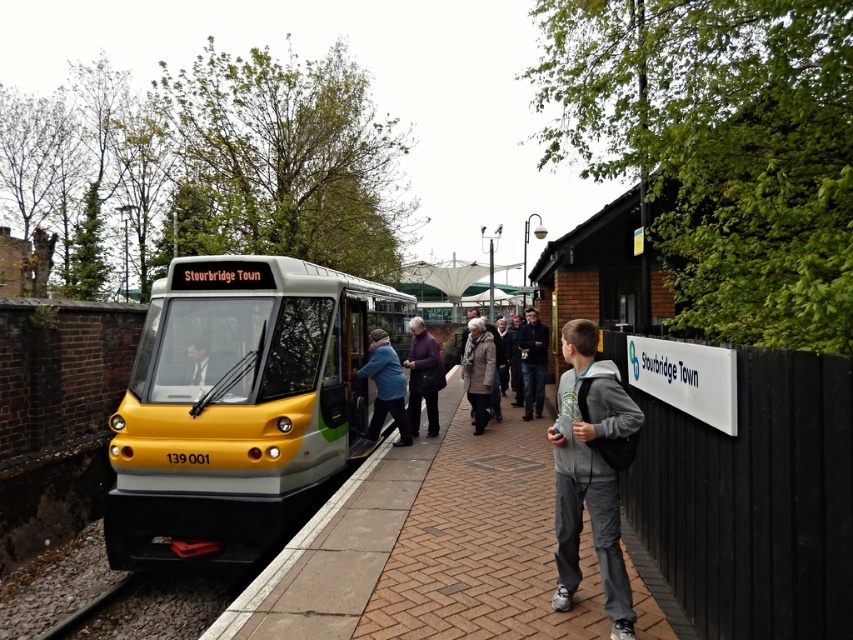
Question: Is brick platform at center wider than dark gray jacket at center?

Choices:
 (A) yes
 (B) no

Answer: (A)

Question: Which object is closer to the camera taking this photo?

Choices:
 (A) gray fleece jacket at center
 (B) yellow metallic train at center

Answer: (A)

Question: Which point is closer to the camera?

Choices:
 (A) (177, 321)
 (B) (405, 561)

Answer: (B)

Question: Which point is closer to the camera taking this photo?

Choices:
 (A) (527, 412)
 (B) (438, 368)
 (C) (132, 604)

Answer: (C)

Question: Is gray fleece jacket at center closer to camera compared to blue fabric jacket at center?

Choices:
 (A) yes
 (B) no

Answer: (A)

Question: Is gray fleece jacket at center smaller than blue fabric jacket at center?

Choices:
 (A) yes
 (B) no

Answer: (A)